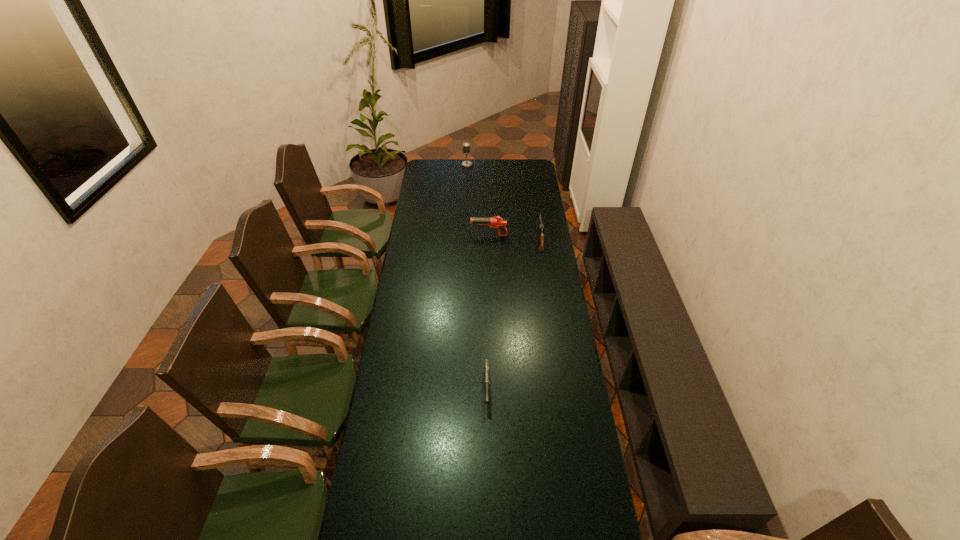
Where is `object situated at the far edge`? This screenshot has width=960, height=540. object situated at the far edge is located at coordinates 466,146.

At what (x,y) coordinates should I click in order to perform the action: click on object present at the right edge. Please return your answer as a coordinate pair (x, y). Looking at the image, I should click on (541, 227).

In the image, there is a desktop. Identify the location of vacant space at the far edge. (484, 164).

The image size is (960, 540). What are the coordinates of `vacant region at the left edge of the desktop` in the screenshot? It's located at (426, 192).

This screenshot has width=960, height=540. Find the location of `free region at the right edge of the desktop`. free region at the right edge of the desktop is located at coordinates (541, 294).

In the image, there is a desktop. At what (x,y) coordinates should I click in order to perform the action: click on vacant area at the far left corner. Please return your answer as a coordinate pair (x, y). Looking at the image, I should click on (446, 159).

Where is `vacant space in between the microphone and the rightmost object`? The image size is (960, 540). vacant space in between the microphone and the rightmost object is located at coordinates (503, 202).

The image size is (960, 540). I want to click on vacant point located between the tallest object and the nearest object, so click(x=477, y=276).

This screenshot has height=540, width=960. I want to click on vacant space that's between the rightmost object and the shortest object, so click(x=514, y=315).

Where is `unoccupied area between the nearest object and the microphone`? unoccupied area between the nearest object and the microphone is located at coordinates (477, 276).